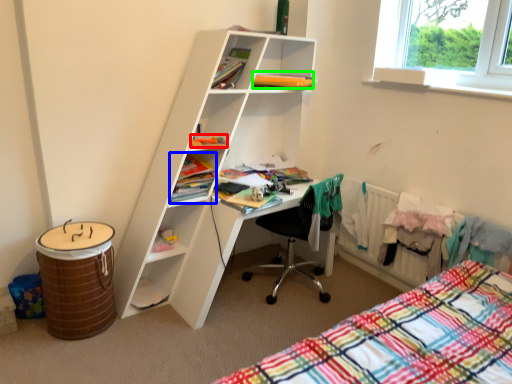
Question: Estimate the real-world distances between objects in this image. Which object is closer to book (highlighted by a red box), book (highlighted by a blue box) or book (highlighted by a green box)?

Choices:
 (A) book
 (B) book

Answer: (A)